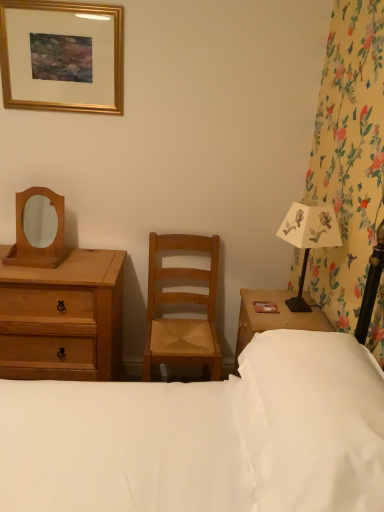
Question: Is the depth of gold wooden picture frame at upper left greater than that of light brown wooden chest of drawers at left?

Choices:
 (A) no
 (B) yes

Answer: (B)

Question: From the image's perspective, is gold wooden picture frame at upper left located beneath light brown wooden chest of drawers at left?

Choices:
 (A) no
 (B) yes

Answer: (A)

Question: Could light brown wooden chest of drawers at left be considered to be inside gold wooden picture frame at upper left?

Choices:
 (A) yes
 (B) no

Answer: (B)

Question: Can we say gold wooden picture frame at upper left lies outside light brown wooden chest of drawers at left?

Choices:
 (A) yes
 (B) no

Answer: (A)

Question: Does gold wooden picture frame at upper left have a lesser height compared to light brown wooden chest of drawers at left?

Choices:
 (A) no
 (B) yes

Answer: (B)

Question: Is gold wooden picture frame at upper left inside or outside of light brown wooden chest of drawers at left?

Choices:
 (A) outside
 (B) inside

Answer: (A)

Question: Is gold wooden picture frame at upper left in front of or behind light brown wooden chest of drawers at left in the image?

Choices:
 (A) front
 (B) behind

Answer: (B)

Question: Looking at the image, does gold wooden picture frame at upper left seem bigger or smaller compared to light brown wooden chest of drawers at left?

Choices:
 (A) small
 (B) big

Answer: (A)

Question: From a real-world perspective, is gold wooden picture frame at upper left above or below light brown wooden chest of drawers at left?

Choices:
 (A) below
 (B) above

Answer: (B)

Question: From a real-world perspective, relative to wooden mirror at left, is white fabric bed at center vertically above or below?

Choices:
 (A) below
 (B) above

Answer: (A)

Question: From the image's perspective, is white fabric bed at center located above or below wooden mirror at left?

Choices:
 (A) above
 (B) below

Answer: (B)

Question: Considering the positions of point click(x=236, y=416) and point click(x=18, y=238), is point click(x=236, y=416) closer or farther from the camera than point click(x=18, y=238)?

Choices:
 (A) closer
 (B) farther

Answer: (A)

Question: In the image, is white fabric bed at center positioned in front of or behind wooden mirror at left?

Choices:
 (A) behind
 (B) front

Answer: (B)

Question: Considering the positions of light brown wooden chest of drawers at left and white paper lampshade at right in the image, is light brown wooden chest of drawers at left taller or shorter than white paper lampshade at right?

Choices:
 (A) tall
 (B) short

Answer: (A)

Question: Is light brown wooden chest of drawers at left inside or outside of white paper lampshade at right?

Choices:
 (A) outside
 (B) inside

Answer: (A)